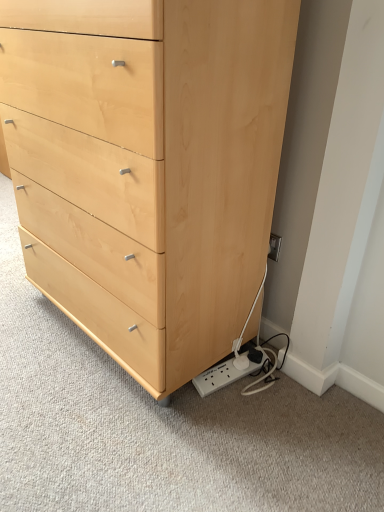
The image size is (384, 512). I want to click on vacant space in front of natural wood chest of drawers at lower left, so click(x=125, y=429).